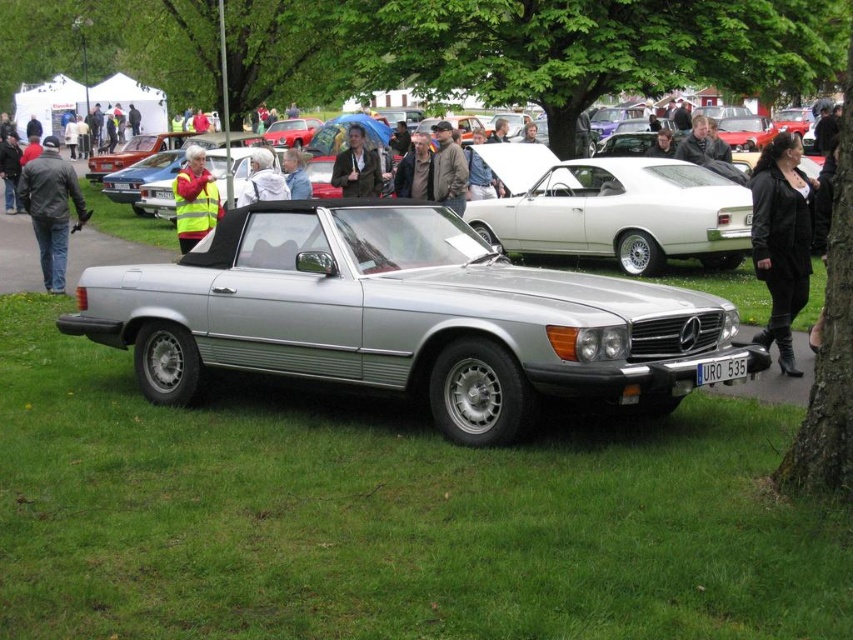
Can you confirm if reflective silver jacket at center is positioned below white plastic license plate at center?

Actually, reflective silver jacket at center is above white plastic license plate at center.

Between point (262, 177) and point (717, 371), which one is positioned behind?

The point (262, 177) is behind.

I want to click on reflective silver jacket at center, so click(262, 179).

Between point (28, 429) and point (444, 180), which one is positioned behind?

The point (444, 180) is behind.

Is green grass at lower center to the left of brown leather jacket at center from the viewer's perspective?

Correct, you'll find green grass at lower center to the left of brown leather jacket at center.

Between point (479, 493) and point (433, 125), which one is positioned in front?

Point (479, 493) is in front.

Identify the location of green grass at lower center. (387, 515).

Can you confirm if green grass at lower center is positioned below dark brown leather jacket at center?

Indeed, green grass at lower center is positioned under dark brown leather jacket at center.

Between green grass at lower center and dark brown leather jacket at center, which one appears on the right side from the viewer's perspective?

From the viewer's perspective, green grass at lower center appears more on the right side.

Identify the location of green grass at lower center. (387, 515).